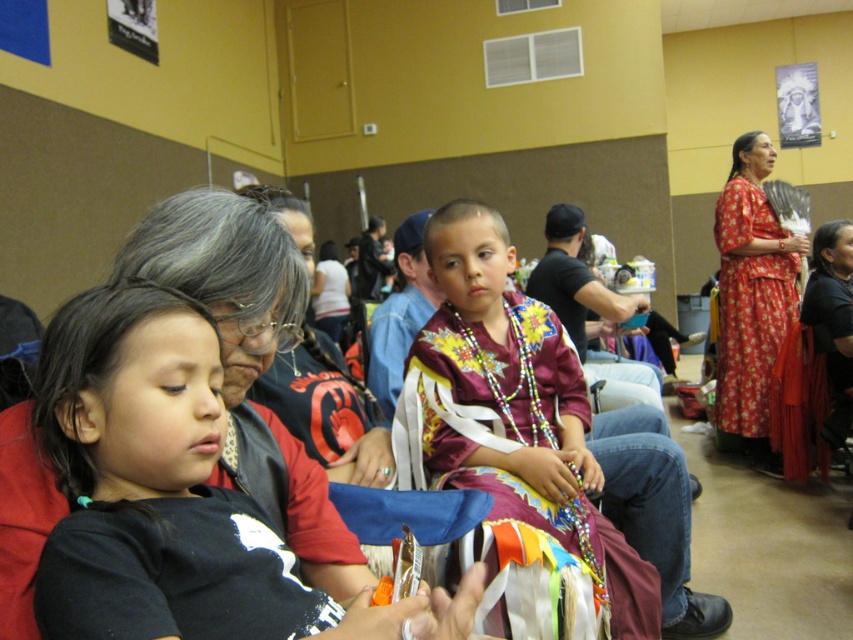
This screenshot has height=640, width=853. I want to click on black fabric shirt at left, so click(x=173, y=496).

Looking at this image, which is more to the right, black fabric shirt at left or floral-patterned fabric dress at upper right?

From the viewer's perspective, floral-patterned fabric dress at upper right appears more on the right side.

Where is `black fabric shirt at left`? Image resolution: width=853 pixels, height=640 pixels. black fabric shirt at left is located at coordinates (173, 496).

Does black fabric shirt at left have a smaller size compared to beaded fabric dress at center?

Yes.

Who is lower down, black fabric shirt at left or beaded fabric dress at center?

beaded fabric dress at center

Is point (444, 600) behind point (505, 432)?

No, (444, 600) is closer to viewer.

At what (x,y) coordinates should I click in order to perform the action: click on black fabric shirt at left. Please return your answer as a coordinate pair (x, y). This screenshot has width=853, height=640. Looking at the image, I should click on (173, 496).

Does beaded fabric dress at center appear over floral-patterned fabric dress at upper right?

Actually, beaded fabric dress at center is below floral-patterned fabric dress at upper right.

Who is positioned more to the left, beaded fabric dress at center or floral-patterned fabric dress at upper right?

beaded fabric dress at center

Where is `beaded fabric dress at center`? The height and width of the screenshot is (640, 853). beaded fabric dress at center is located at coordinates (541, 456).

In order to click on beaded fabric dress at center in this screenshot , I will do `click(541, 456)`.